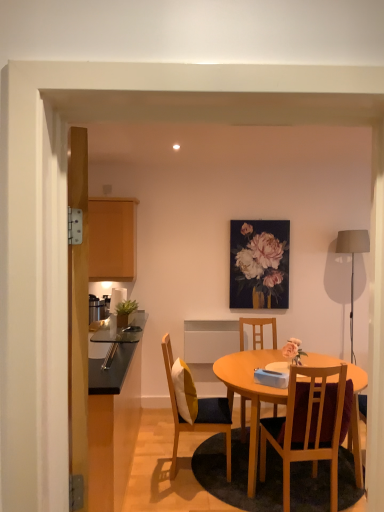
At what (x,y) coordinates should I click in order to perform the action: click on free spot above matte floral painting at upper center (from a real-world perspective). Please return your answer as a coordinate pair (x, y). Image resolution: width=384 pixels, height=512 pixels. Looking at the image, I should click on (270, 215).